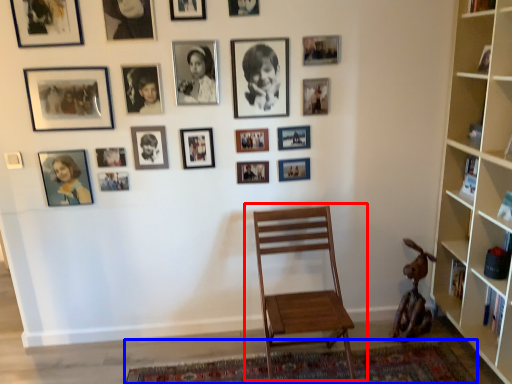
Question: Among these objects, which one is nearest to the camera, chair (highlighted by a red box) or mat (highlighted by a blue box)?

Choices:
 (A) chair
 (B) mat

Answer: (A)